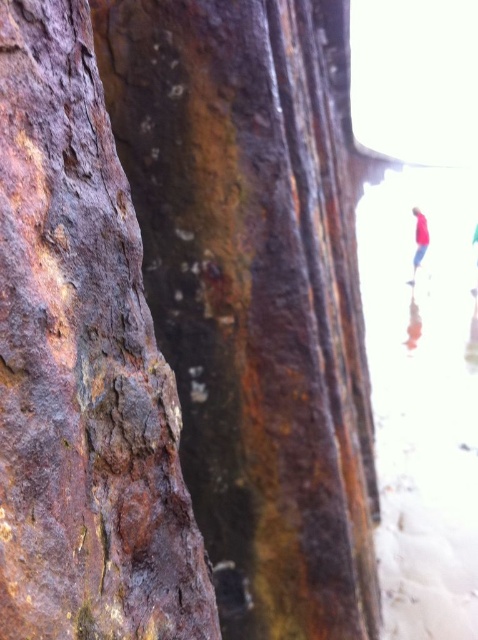
You are standing at the center of the image. Which direction should you move to get closer to the rusty metal rock at left?

Since the rusty metal rock at left is located at coordinates 0.573 on the x axis and 0.172 on the y axis, which places it to the left side of the image, you should move to the left to get closer to it.